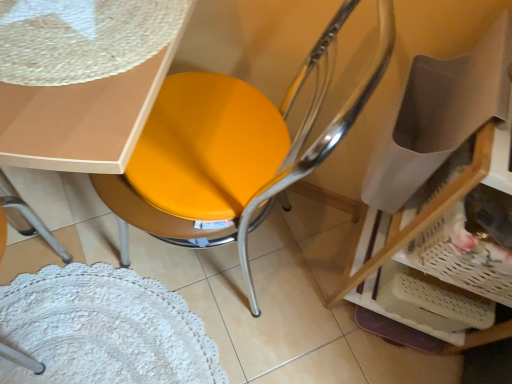
Question: In the image, is matte yellow seat at center on the left side or the right side of matte white table at upper left?

Choices:
 (A) left
 (B) right

Answer: (B)

Question: From their relative heights in the image, would you say matte yellow seat at center is taller or shorter than matte white table at upper left?

Choices:
 (A) tall
 (B) short

Answer: (A)

Question: Considering the real-world distances, which object is farthest from the matte yellow seat at center?

Choices:
 (A) white woven basket at lower right
 (B) matte white table at upper left

Answer: (A)

Question: Estimate the real-world distances between objects in this image. Which object is closer to the matte white table at upper left?

Choices:
 (A) white woven basket at lower right
 (B) matte yellow seat at center

Answer: (B)